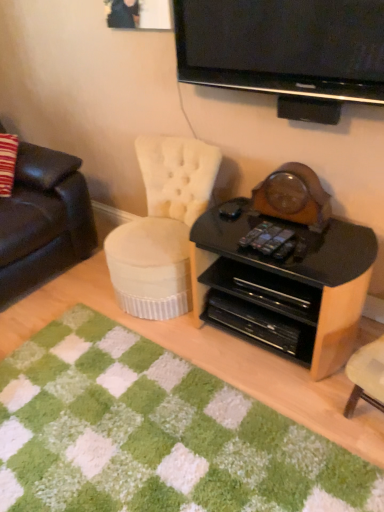
Image resolution: width=384 pixels, height=512 pixels. I want to click on unoccupied space behind black plastic remote control at center, so click(x=259, y=222).